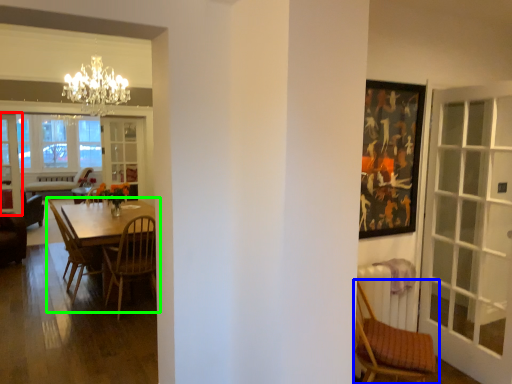
Question: Which object is the farthest from screen door (highlighted by a red box)? Choose among these: chair (highlighted by a blue box) or kitchen & dining room table (highlighted by a green box).

Choices:
 (A) chair
 (B) kitchen & dining room table

Answer: (A)